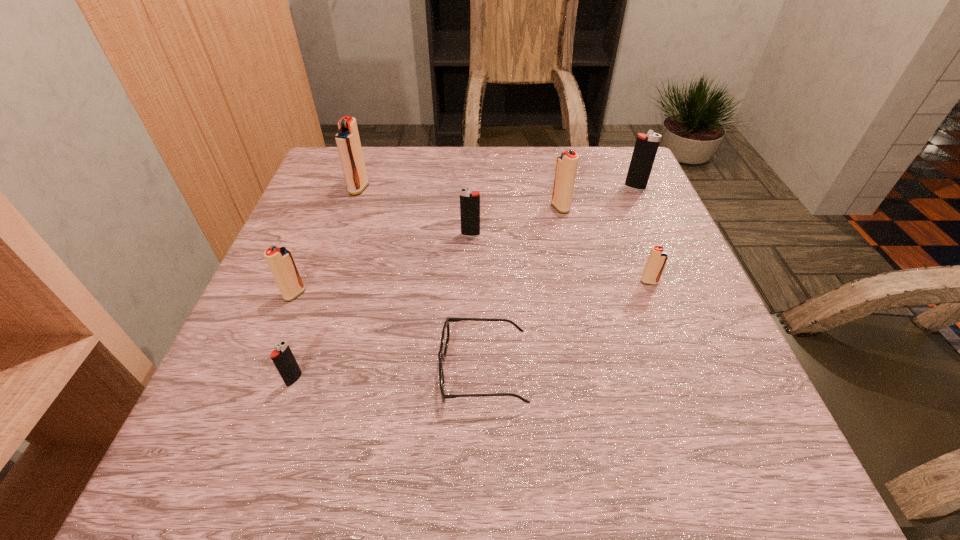
Locate an element on the screen. the farthest red igniter is located at coordinates (347, 139).

What are the coordinates of `the biggest red igniter` in the screenshot? It's located at (347, 139).

Locate an element on the screen. the third smallest red igniter is located at coordinates (566, 167).

Locate an element on the screen. The width and height of the screenshot is (960, 540). the third red igniter from left to right is located at coordinates (566, 167).

Where is `the biggest black igniter`? the biggest black igniter is located at coordinates (646, 146).

Locate an element on the screen. The image size is (960, 540). the rightmost object is located at coordinates (646, 146).

Where is `the second farthest black igniter`? the second farthest black igniter is located at coordinates (469, 200).

Locate an element on the screen. the fourth farthest igniter is located at coordinates (469, 200).

Locate an element on the screen. Image resolution: width=960 pixels, height=540 pixels. the nearest red igniter is located at coordinates 280,260.

Find the location of a particular element. the leftmost object is located at coordinates (280, 260).